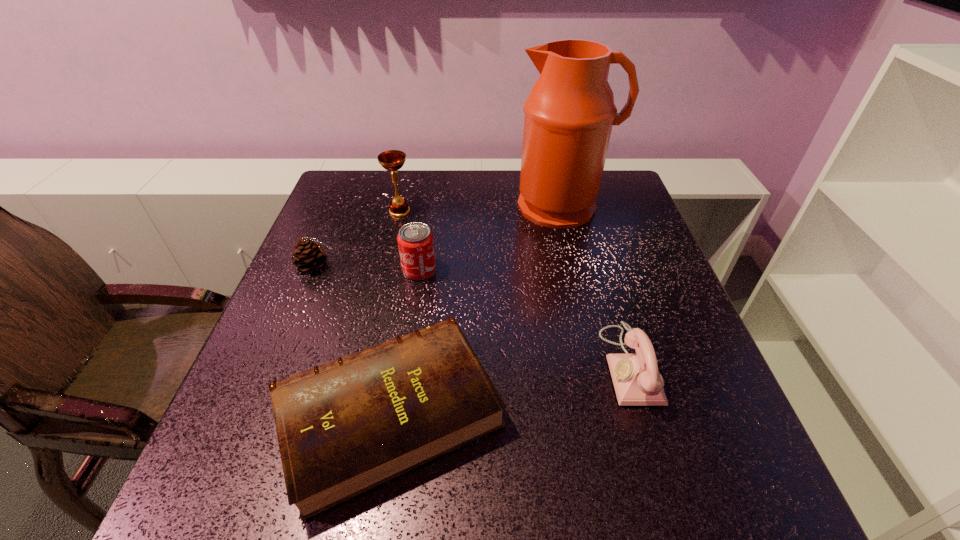
Locate an element on the screen. unoccupied area between the second tallest object and the water jug is located at coordinates (481, 209).

Locate an element on the screen. The width and height of the screenshot is (960, 540). free space that is in between the can and the pinecone is located at coordinates (368, 268).

I want to click on vacant point located between the can and the second shortest object, so click(x=368, y=268).

Locate an element on the screen. free spot between the shortest object and the telephone is located at coordinates (510, 389).

Find the location of a particular element. unoccupied area between the telephone and the chalice is located at coordinates coord(515,288).

Where is `unoccupied area between the water jug and the can`? unoccupied area between the water jug and the can is located at coordinates [492, 238].

At what (x,y) coordinates should I click in order to perform the action: click on vacant space that's between the tallest object and the shortest object. Please return your answer as a coordinate pair (x, y). Image resolution: width=960 pixels, height=540 pixels. Looking at the image, I should click on (476, 309).

The width and height of the screenshot is (960, 540). What are the coordinates of `the closest object to the fifth tallest object` in the screenshot? It's located at (415, 240).

Where is `object that stands as the second closest to the water jug`? Image resolution: width=960 pixels, height=540 pixels. object that stands as the second closest to the water jug is located at coordinates (392, 160).

Identify the location of blank area in the image that satisfies the following two spatial constraints: 1. with a leaf charm attached to the pinecone; 2. on the back side of the can. click(x=314, y=270).